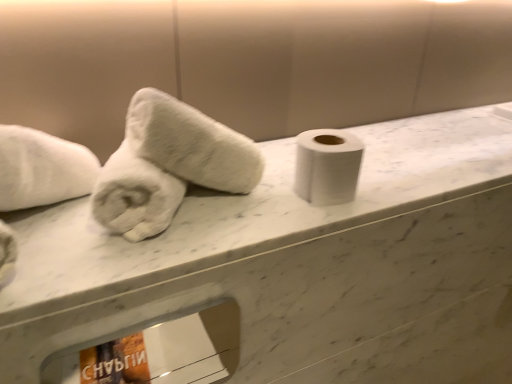
Question: Can you confirm if white fluffy towel at left, positioned as the 2th towel in left-to-right order, is positioned to the right of white matte toilet paper at center?

Choices:
 (A) yes
 (B) no

Answer: (B)

Question: Are white fluffy towel at left, the 1th towel in the right-to-left sequence, and white matte toilet paper at center located far from each other?

Choices:
 (A) no
 (B) yes

Answer: (A)

Question: Does white fluffy towel at left, the 1th towel in the right-to-left sequence, come in front of white matte toilet paper at center?

Choices:
 (A) yes
 (B) no

Answer: (A)

Question: Is white fluffy towel at left, the 1th towel in the right-to-left sequence, taller than white matte toilet paper at center?

Choices:
 (A) yes
 (B) no

Answer: (A)

Question: From the image's perspective, is white fluffy towel at left, positioned as the 2th towel in left-to-right order, on white matte toilet paper at center?

Choices:
 (A) yes
 (B) no

Answer: (A)

Question: From the image's perspective, is white fluffy towel at left, the 1th towel in the right-to-left sequence, above or below white marble counter at center?

Choices:
 (A) above
 (B) below

Answer: (A)

Question: In the image, is white fluffy towel at left, positioned as the 2th towel in left-to-right order, on the left side or the right side of white marble counter at center?

Choices:
 (A) right
 (B) left

Answer: (B)

Question: Considering their positions, is white fluffy towel at left, positioned as the 2th towel in left-to-right order, located in front of or behind white marble counter at center?

Choices:
 (A) behind
 (B) front

Answer: (A)

Question: Is white fluffy towel at left, positioned as the 2th towel in left-to-right order, bigger or smaller than white marble counter at center?

Choices:
 (A) small
 (B) big

Answer: (A)

Question: In terms of width, does white marble counter at center look wider or thinner when compared to white matte toilet paper at center?

Choices:
 (A) wide
 (B) thin

Answer: (A)

Question: Based on their sizes in the image, would you say white marble counter at center is bigger or smaller than white matte toilet paper at center?

Choices:
 (A) big
 (B) small

Answer: (A)

Question: From a real-world perspective, is white marble counter at center above or below white matte toilet paper at center?

Choices:
 (A) above
 (B) below

Answer: (B)

Question: From the image's perspective, is white marble counter at center located above or below white matte toilet paper at center?

Choices:
 (A) below
 (B) above

Answer: (B)

Question: Looking at their shapes, would you say white matte toilet paper at center is wider or thinner than white marble counter at center?

Choices:
 (A) thin
 (B) wide

Answer: (A)

Question: Is white matte toilet paper at center taller or shorter than white marble counter at center?

Choices:
 (A) short
 (B) tall

Answer: (B)